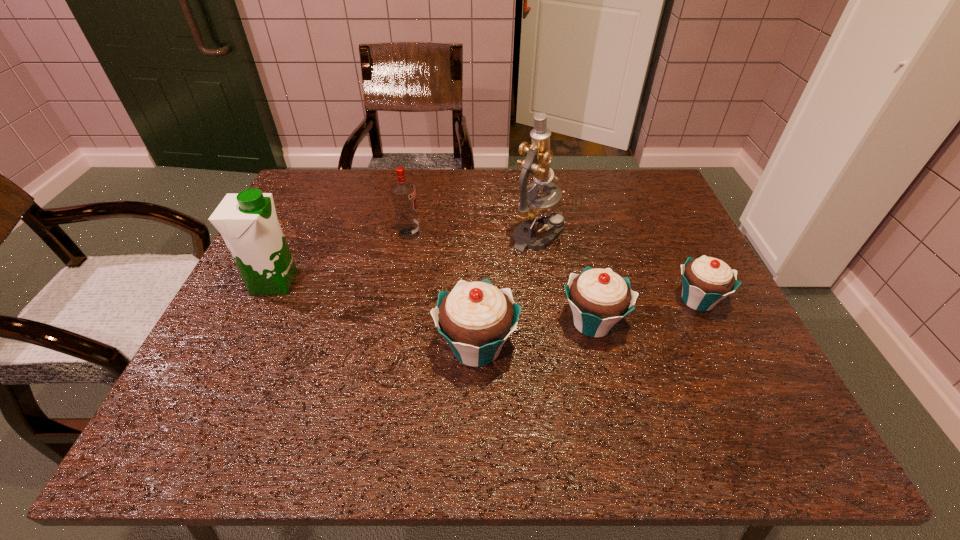
In the image, there is a desktop. At what (x,y) coordinates should I click in order to perform the action: click on vacant space at the right edge. Please return your answer as a coordinate pair (x, y). This screenshot has height=540, width=960. Looking at the image, I should click on (747, 343).

I want to click on vacant space at the far left corner of the desktop, so click(310, 208).

Where is `free space at the near right corner`? free space at the near right corner is located at coordinates (725, 361).

Where is `vacant space in between the fifth tallest object and the shortest object`? The height and width of the screenshot is (540, 960). vacant space in between the fifth tallest object and the shortest object is located at coordinates (645, 312).

The image size is (960, 540). Find the location of `vacant point located between the second cupcake from left to right and the vodka`. vacant point located between the second cupcake from left to right and the vodka is located at coordinates (501, 278).

Find the location of `vacant point located between the third object from left to right and the second cupcake from right to left`. vacant point located between the third object from left to right and the second cupcake from right to left is located at coordinates (535, 335).

Identify the location of vacant space that's between the second tallest object and the tallest object. pos(406,259).

What are the coordinates of `empty space that is in between the leftmost object and the fifth object from right to left` in the screenshot? It's located at point(342,258).

Locate an element on the screen. The image size is (960, 540). vacant area that lies between the second tallest cupcake and the shortest cupcake is located at coordinates (645, 312).

Identify the location of free point between the second object from left to right and the leftmost cupcake. This screenshot has height=540, width=960. (443, 291).